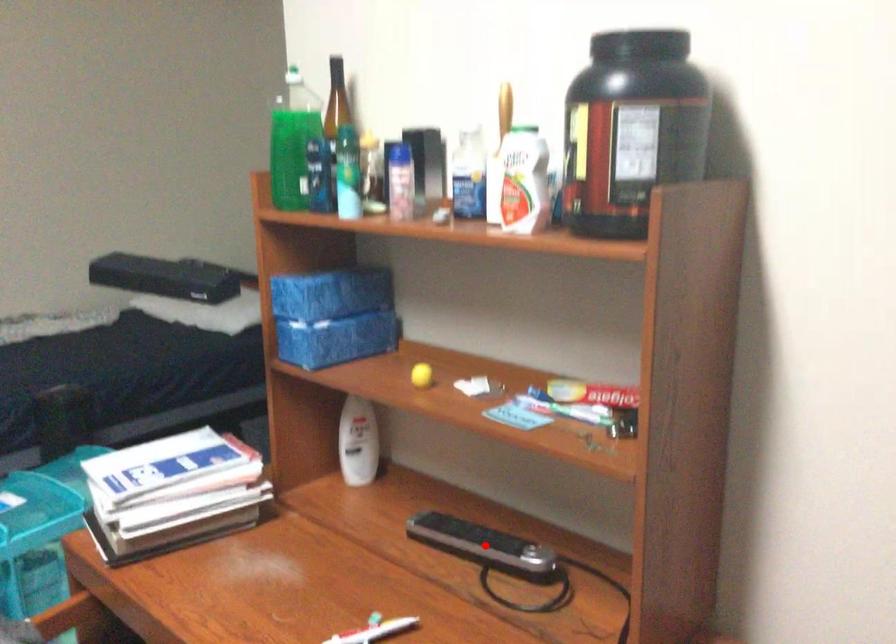
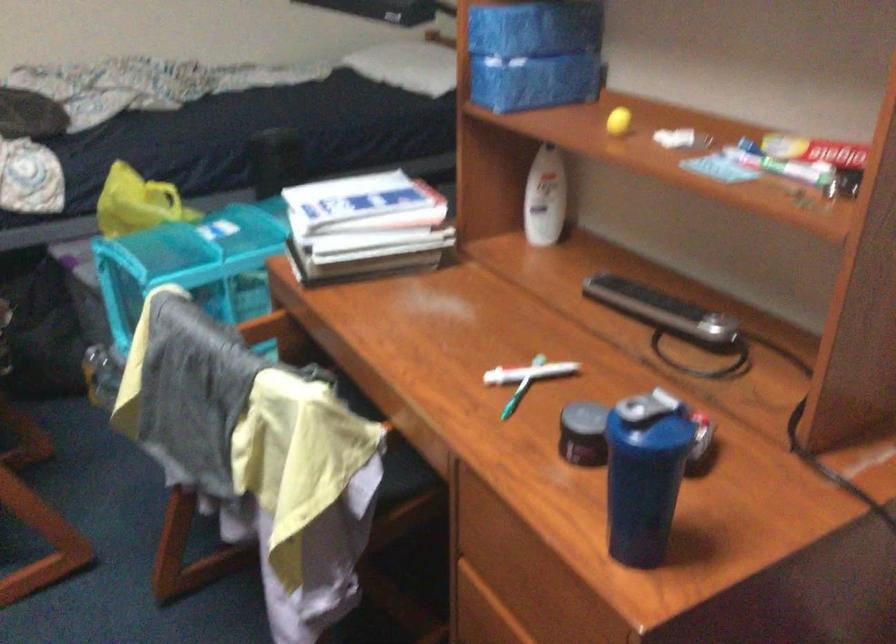
Where in the second image is the point corresponding to the highlighted location from the first image?

(661, 308)